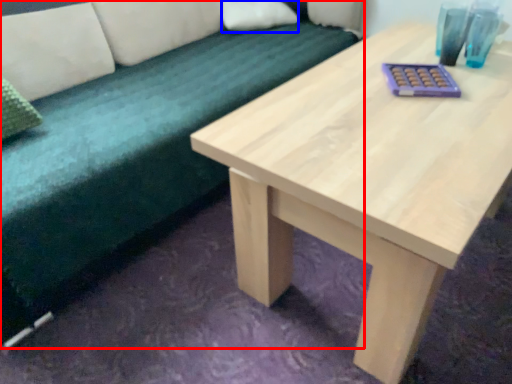
Question: Which of the following is the farthest to the observer, studio couch (highlighted by a red box) or pillow (highlighted by a blue box)?

Choices:
 (A) studio couch
 (B) pillow

Answer: (B)